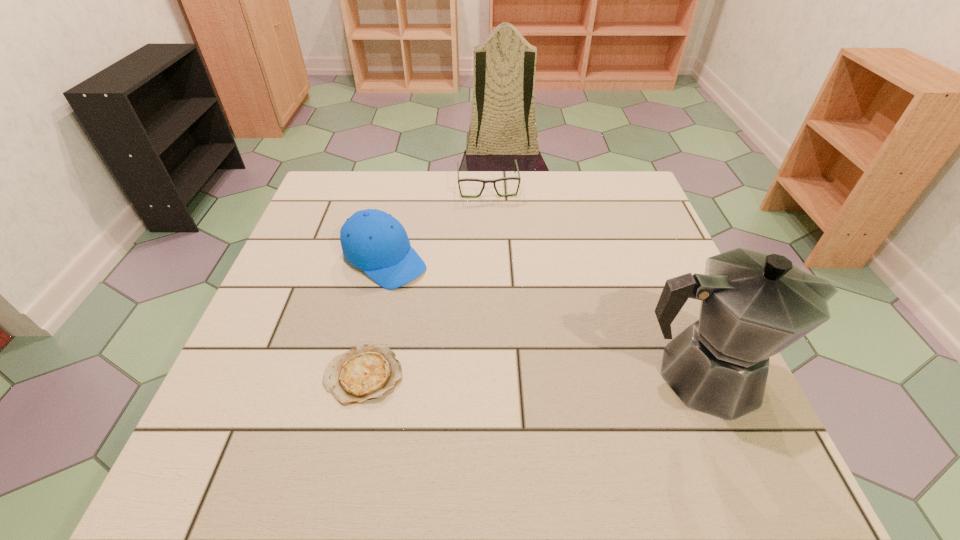
I want to click on vacant space at the far edge of the desktop, so click(534, 215).

Find the location of a particular element. Image resolution: width=960 pixels, height=540 pixels. vacant space at the near edge of the desktop is located at coordinates (606, 428).

Find the location of a particular element. Image resolution: width=960 pixels, height=540 pixels. vacant point at the left edge is located at coordinates (283, 269).

Image resolution: width=960 pixels, height=540 pixels. Identify the location of free space at the right edge of the desktop. (642, 232).

Identify the location of vacant region at the far left corner of the desktop. The width and height of the screenshot is (960, 540). (333, 174).

In order to click on vacant space at the far right corner of the desktop in this screenshot , I will do `click(596, 205)`.

At what (x,y) coordinates should I click in order to perform the action: click on free space between the shortest object and the third shortest object. Please return your answer as a coordinate pair (x, y). The width and height of the screenshot is (960, 540). Looking at the image, I should click on (374, 317).

Locate an element on the screen. Image resolution: width=960 pixels, height=540 pixels. free spot between the third nearest object and the coffeepot is located at coordinates (543, 317).

Find the location of `vacant area that lies between the tallest object and the farthest object`. vacant area that lies between the tallest object and the farthest object is located at coordinates (595, 281).

Find the location of a particular element. The height and width of the screenshot is (540, 960). vacant area between the quiche and the third nearest object is located at coordinates (374, 317).